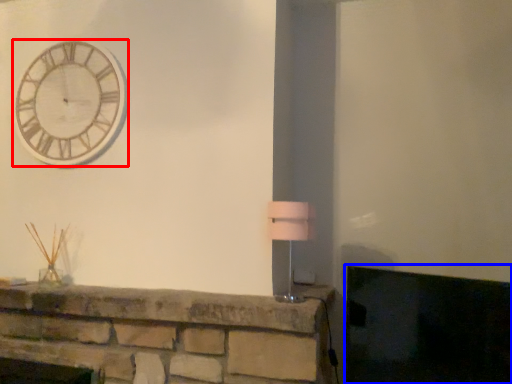
Question: Among these objects, which one is nearest to the camera, wall clock (highlighted by a red box) or fireplace (highlighted by a blue box)?

Choices:
 (A) wall clock
 (B) fireplace

Answer: (B)